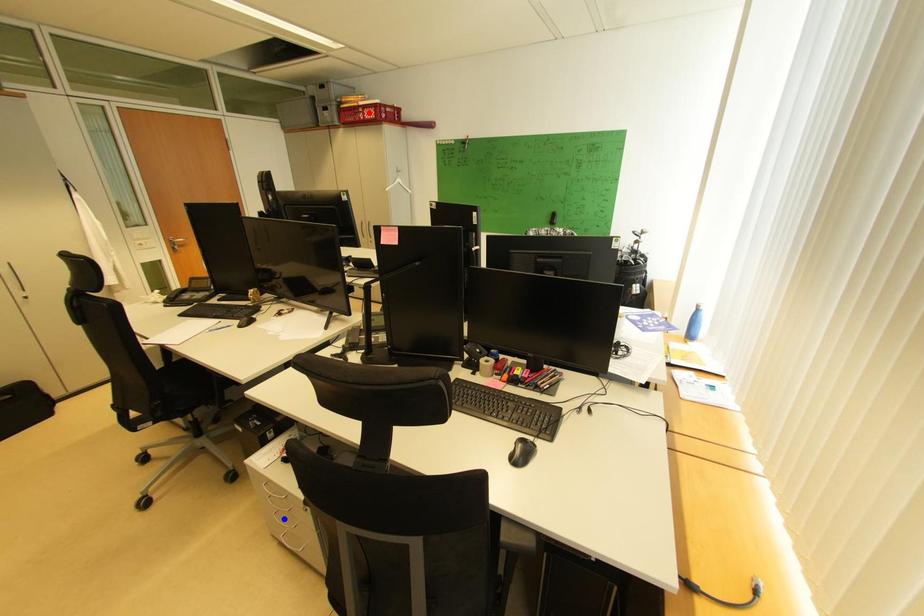
Question: In the image, two points are highlighted. Which point is nearer to the camera? Reply with the corresponding letter.

Choices:
 (A) blue point
 (B) red point

Answer: (A)